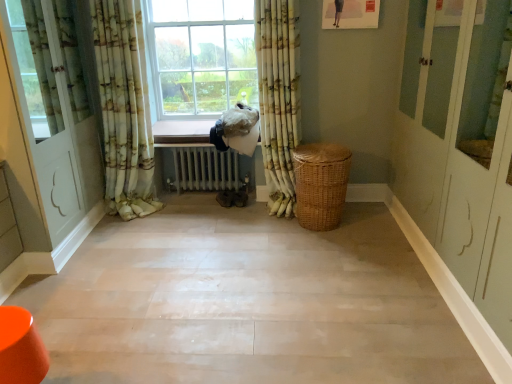
This screenshot has width=512, height=384. What are the coordinates of `vacant space situated on the left part of floral fabric curtain at center, positioned as the 1th curtain in right-to-left order` in the screenshot? It's located at (238, 221).